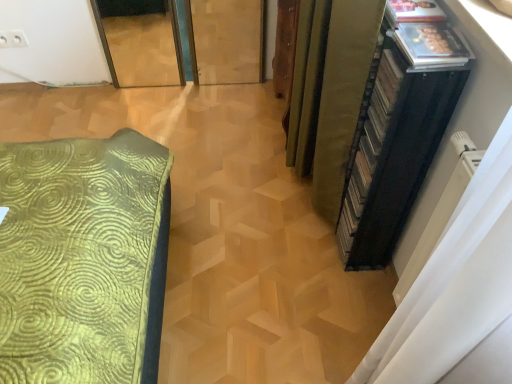
Question: From the image's perspective, is white plastic electric outlet at upper left positioned above or below black plastic file cabinet at right?

Choices:
 (A) above
 (B) below

Answer: (A)

Question: From a real-world perspective, is white plastic electric outlet at upper left physically located above or below black plastic file cabinet at right?

Choices:
 (A) above
 (B) below

Answer: (B)

Question: Based on their relative distances, which object is nearer to the green fabric curtain at right?

Choices:
 (A) white plastic electric outlet at upper left
 (B) black plastic file cabinet at right

Answer: (B)

Question: Estimate the real-world distances between objects in this image. Which object is farther from the black plastic file cabinet at right?

Choices:
 (A) green fabric curtain at right
 (B) white plastic electric outlet at upper left

Answer: (B)